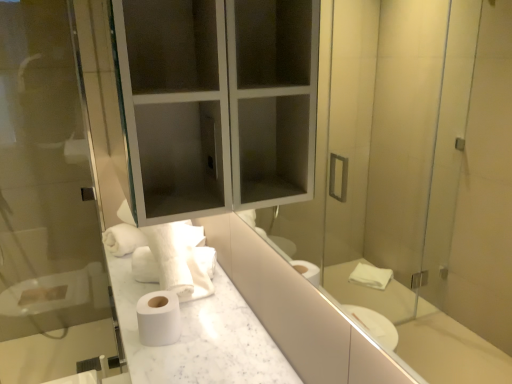
Image resolution: width=512 pixels, height=384 pixels. What are the coordinates of `free space in front of white matte toilet paper at center` in the screenshot? It's located at (158, 361).